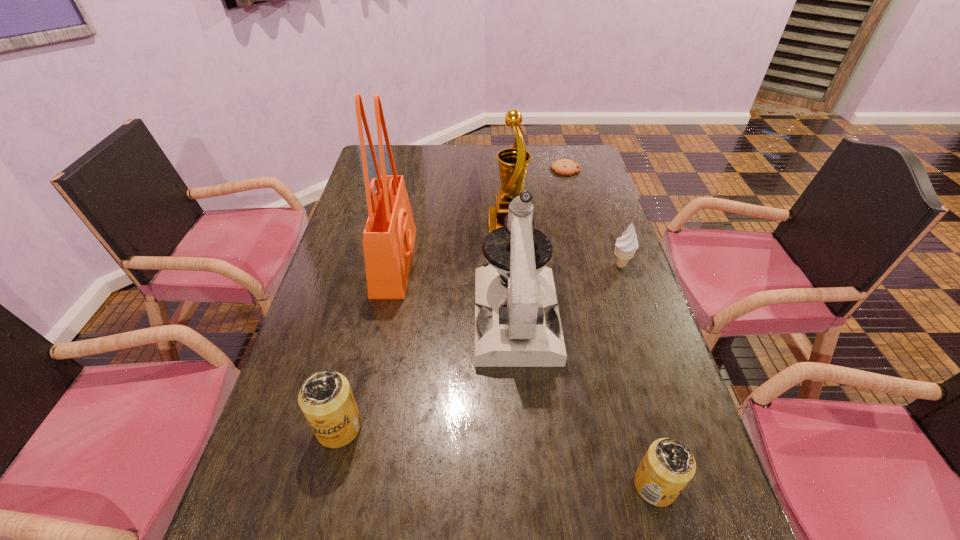
The image size is (960, 540). What are the coordinates of `vacant space at the far edge of the desktop` in the screenshot? It's located at (499, 175).

Find the location of a particular element. free space at the left edge is located at coordinates (364, 194).

The width and height of the screenshot is (960, 540). Identify the location of vacant area at the right edge. (626, 361).

I want to click on free space at the far left corner, so click(x=379, y=158).

Locate an element on the screen. vacant space that's between the shortest object and the tote bag is located at coordinates (480, 215).

This screenshot has width=960, height=540. Find the location of `vacant area between the award and the cookie`. vacant area between the award and the cookie is located at coordinates (538, 198).

Where is `free spot between the right beer can and the microscope`? This screenshot has height=540, width=960. free spot between the right beer can and the microscope is located at coordinates (586, 401).

This screenshot has width=960, height=540. In order to click on vacant area that lies between the nearest object and the microscope in this screenshot , I will do `click(586, 401)`.

The width and height of the screenshot is (960, 540). I want to click on free space between the shortest object and the tallest object, so click(x=480, y=215).

You are a GUI agent. You are given a task and a screenshot of the screen. Output one action in this format:
    pyautogui.click(x=<x>, y=<y>)
    Task: Click on the free area in between the left beer can and the microscope
    The image size is (960, 540).
    Given the screenshot: What is the action you would take?
    pyautogui.click(x=427, y=372)